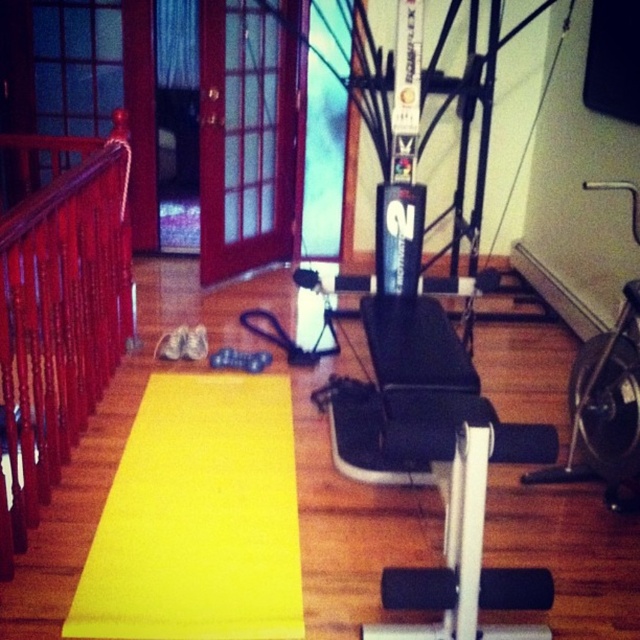
Which of these two, yellow rubber mat at center or polished wood railing at left, stands taller?

With more height is polished wood railing at left.

Does yellow rubber mat at center have a greater height compared to polished wood railing at left?

In fact, yellow rubber mat at center may be shorter than polished wood railing at left.

The image size is (640, 640). I want to click on yellow rubber mat at center, so click(198, 518).